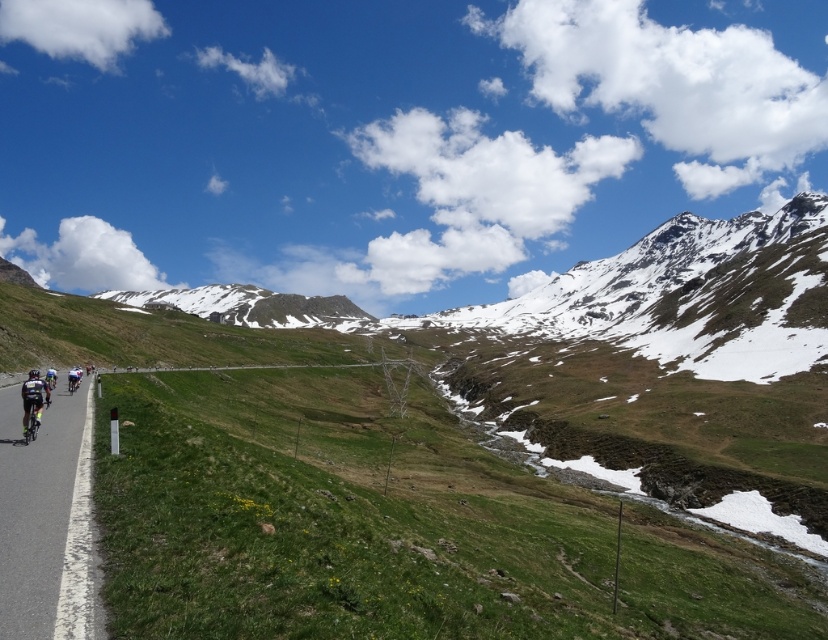
Question: Can you confirm if shiny metallic bicycle at left is wider than shiny silver bicycle at left?

Choices:
 (A) no
 (B) yes

Answer: (B)

Question: Is snowy rock mountain at upper center wider than shiny silver bicycle at left?

Choices:
 (A) no
 (B) yes

Answer: (B)

Question: Which point is farther to the camera?

Choices:
 (A) (3, 560)
 (B) (78, 376)
 (C) (34, 412)

Answer: (B)

Question: Can you confirm if shiny black bicycle at left is positioned to the left of shiny silver bicycle at left?

Choices:
 (A) no
 (B) yes

Answer: (A)

Question: Which of the following is the farthest from the observer?

Choices:
 (A) (76, 380)
 (B) (23, 412)
 (C) (315, 307)

Answer: (C)

Question: Which point is closer to the camera taking this photo?

Choices:
 (A) (31, 410)
 (B) (244, 316)
 (C) (70, 392)

Answer: (A)